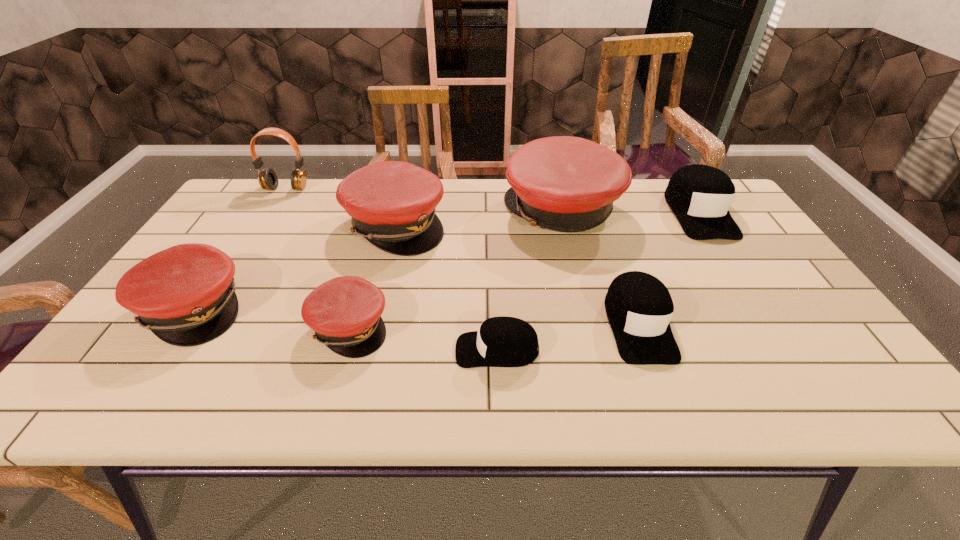
What are the coordinates of `the smallest black cap` in the screenshot? It's located at (502, 341).

This screenshot has height=540, width=960. In order to click on the leftmost black cap in this screenshot , I will do `click(502, 341)`.

Find the location of `free location located 0.390m on the ear cups of the brown headset`. free location located 0.390m on the ear cups of the brown headset is located at coordinates (232, 274).

Where is `vacant space located 0.080m on the front-facing side of the rightmost red cap`? Image resolution: width=960 pixels, height=540 pixels. vacant space located 0.080m on the front-facing side of the rightmost red cap is located at coordinates (478, 211).

Image resolution: width=960 pixels, height=540 pixels. Identify the location of vacant space located on the front-facing side of the rightmost red cap. (485, 211).

At what (x,y) coordinates should I click in order to perform the action: click on vacant space located 0.370m on the front-facing side of the rightmost red cap. Please return your answer as a coordinate pair (x, y). The height and width of the screenshot is (540, 960). Looking at the image, I should click on pyautogui.click(x=383, y=211).

Where is `free location located on the front-facing side of the third smallest red cap`? Image resolution: width=960 pixels, height=540 pixels. free location located on the front-facing side of the third smallest red cap is located at coordinates (578, 225).

You are a GUI agent. You are given a task and a screenshot of the screen. Output one action in this format:
    pyautogui.click(x=<x>, y=<y>)
    Task: Click on the free point located 0.150m on the front-facing side of the rightmost black cap
    The height and width of the screenshot is (540, 960).
    Given the screenshot: What is the action you would take?
    pyautogui.click(x=741, y=279)

Image resolution: width=960 pixels, height=540 pixels. What are the coordinates of `vacant space located on the front-facing side of the leftmost red cap` in the screenshot? It's located at (302, 308).

The image size is (960, 540). What are the coordinates of `free space located on the front-facing side of the second black cap from right to left` in the screenshot? It's located at pos(667,406).